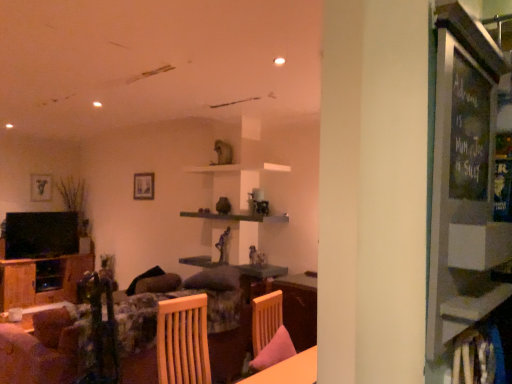
Question: Which direction should I rotate to look at matte glass picture frame at upper center, the 1th picture frame when ordered from right to left?

Choices:
 (A) left
 (B) right

Answer: (A)

Question: Considering the relative sizes of wooden shelf at center and wooden cabinet at left in the image provided, is wooden shelf at center taller than wooden cabinet at left?

Choices:
 (A) no
 (B) yes

Answer: (A)

Question: Can you confirm if wooden shelf at center is positioned to the left of wooden cabinet at left?

Choices:
 (A) no
 (B) yes

Answer: (A)

Question: Considering the relative sizes of wooden shelf at center and wooden cabinet at left in the image provided, is wooden shelf at center shorter than wooden cabinet at left?

Choices:
 (A) no
 (B) yes

Answer: (B)

Question: Are wooden shelf at center and wooden cabinet at left located far from each other?

Choices:
 (A) yes
 (B) no

Answer: (A)

Question: Is wooden shelf at center wider than wooden cabinet at left?

Choices:
 (A) yes
 (B) no

Answer: (B)

Question: Is wooden shelf at center facing towards wooden cabinet at left?

Choices:
 (A) no
 (B) yes

Answer: (A)

Question: From a real-world perspective, is wooden table at lower center located higher than matte black picture frame at upper left, which appears as the second picture frame when viewed from the front?

Choices:
 (A) yes
 (B) no

Answer: (B)

Question: From the image's perspective, is wooden table at lower center above matte black picture frame at upper left, placed as the first picture frame when sorted from back to front?

Choices:
 (A) yes
 (B) no

Answer: (B)

Question: Considering the relative sizes of wooden table at lower center and matte black picture frame at upper left, placed as the first picture frame when sorted from back to front, in the image provided, is wooden table at lower center thinner than matte black picture frame at upper left, placed as the first picture frame when sorted from back to front,?

Choices:
 (A) yes
 (B) no

Answer: (B)

Question: Is wooden table at lower center outside of matte black picture frame at upper left, the 1th picture frame when ordered from left to right?

Choices:
 (A) no
 (B) yes

Answer: (B)

Question: Is wooden table at lower center at the right side of matte black picture frame at upper left, placed as the first picture frame when sorted from back to front?

Choices:
 (A) yes
 (B) no

Answer: (A)

Question: From the image's perspective, is wooden table at lower center below matte black picture frame at upper left, marked as the second picture frame in a right-to-left arrangement?

Choices:
 (A) no
 (B) yes

Answer: (B)

Question: Considering the relative sizes of wooden shelf at center and matte black picture frame at upper left, which appears as the second picture frame when viewed from the front, in the image provided, is wooden shelf at center shorter than matte black picture frame at upper left, which appears as the second picture frame when viewed from the front,?

Choices:
 (A) no
 (B) yes

Answer: (B)